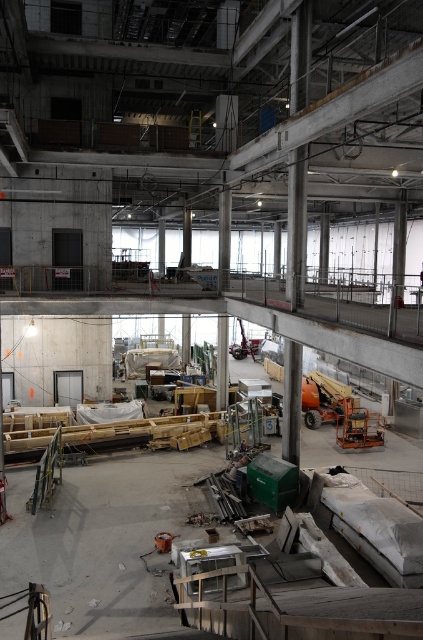
Question: Which point is farther from the camera taking this photo?

Choices:
 (A) (2, 346)
 (B) (236, 349)

Answer: (B)

Question: Considering the relative positions of matte gray concrete pillar at center and metallic orange forklift at center in the image provided, where is matte gray concrete pillar at center located with respect to metallic orange forklift at center?

Choices:
 (A) left
 (B) right

Answer: (A)

Question: Which object is farther from the camera taking this photo?

Choices:
 (A) concrete floor at center
 (B) matte gray concrete pillar at center

Answer: (B)

Question: Does matte gray concrete pillar at center appear under metallic orange forklift at center?

Choices:
 (A) yes
 (B) no

Answer: (A)

Question: Estimate the real-world distances between objects in this image. Which object is closer to the matte gray concrete pillar at center?

Choices:
 (A) concrete floor at center
 (B) metallic orange forklift at center

Answer: (A)

Question: Is concrete floor at center positioned at the back of metallic orange forklift at center?

Choices:
 (A) yes
 (B) no

Answer: (B)